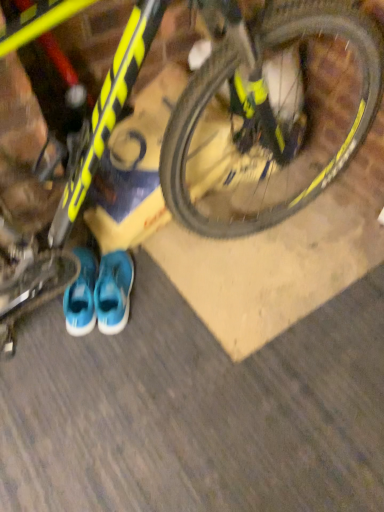
Question: From a real-world perspective, does blue fabric running shoe at lower center sit lower than blue fabric sneakers at lower center?

Choices:
 (A) yes
 (B) no

Answer: (A)

Question: Considering the relative sizes of blue fabric running shoe at lower center and blue fabric sneakers at lower center in the image provided, is blue fabric running shoe at lower center taller than blue fabric sneakers at lower center?

Choices:
 (A) no
 (B) yes

Answer: (A)

Question: Is blue fabric running shoe at lower center behind blue fabric sneakers at lower center?

Choices:
 (A) no
 (B) yes

Answer: (A)

Question: Is blue fabric running shoe at lower center in front of blue fabric sneakers at lower center?

Choices:
 (A) yes
 (B) no

Answer: (A)

Question: From the image's perspective, does blue fabric running shoe at lower center appear higher than blue fabric sneakers at lower center?

Choices:
 (A) yes
 (B) no

Answer: (A)

Question: In terms of size, does yellow matte bicycle at upper center appear bigger or smaller than yellow matte bicycle at upper center?

Choices:
 (A) small
 (B) big

Answer: (B)

Question: From their relative heights in the image, would you say yellow matte bicycle at upper center is taller or shorter than yellow matte bicycle at upper center?

Choices:
 (A) tall
 (B) short

Answer: (A)

Question: From the image's perspective, is yellow matte bicycle at upper center positioned above or below yellow matte bicycle at upper center?

Choices:
 (A) above
 (B) below

Answer: (A)

Question: Is yellow matte bicycle at upper center wider or thinner than yellow matte bicycle at upper center?

Choices:
 (A) wide
 (B) thin

Answer: (B)

Question: Choose the correct answer: Is blue fabric running shoe at lower center inside yellow matte bicycle at upper center or outside it?

Choices:
 (A) outside
 (B) inside

Answer: (B)

Question: Considering the positions of blue fabric running shoe at lower center and yellow matte bicycle at upper center in the image, is blue fabric running shoe at lower center taller or shorter than yellow matte bicycle at upper center?

Choices:
 (A) short
 (B) tall

Answer: (A)

Question: From a real-world perspective, is blue fabric running shoe at lower center above or below yellow matte bicycle at upper center?

Choices:
 (A) above
 (B) below

Answer: (B)

Question: Is point (110, 252) positioned closer to the camera than point (286, 60)?

Choices:
 (A) closer
 (B) farther

Answer: (A)

Question: Is yellow matte bicycle at upper center wider or thinner than blue fabric sneakers at lower center?

Choices:
 (A) thin
 (B) wide

Answer: (B)

Question: Considering the positions of yellow matte bicycle at upper center and blue fabric sneakers at lower center in the image, is yellow matte bicycle at upper center taller or shorter than blue fabric sneakers at lower center?

Choices:
 (A) tall
 (B) short

Answer: (B)